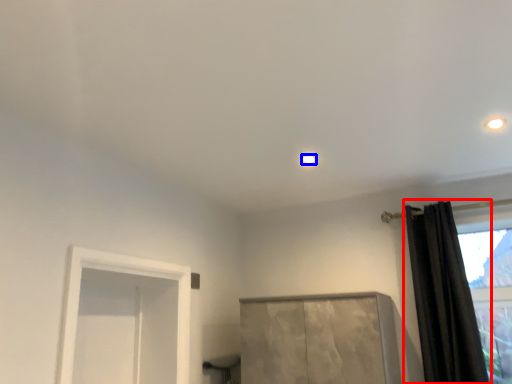
Question: Which of the following is the farthest to the observer, curtain (highlighted by a red box) or lighting (highlighted by a blue box)?

Choices:
 (A) curtain
 (B) lighting

Answer: (B)